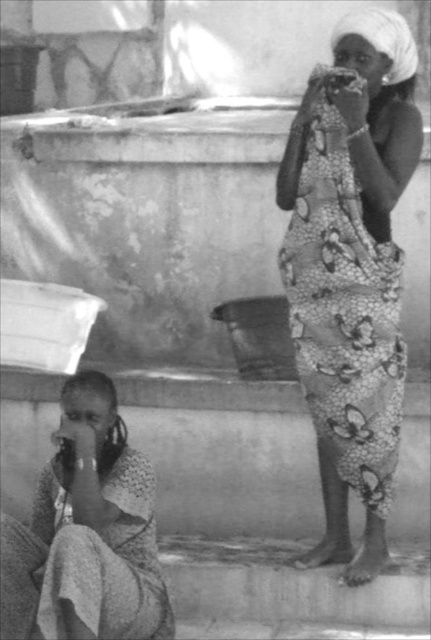
Question: Does floral-patterned fabric at right have a smaller size compared to patterned fabric cloth at lower left?

Choices:
 (A) yes
 (B) no

Answer: (B)

Question: Which point is farther to the camera?

Choices:
 (A) (409, 128)
 (B) (149, 611)

Answer: (A)

Question: Is floral-patterned fabric at right below patterned fabric cloth at lower left?

Choices:
 (A) no
 (B) yes

Answer: (A)

Question: Does floral-patterned fabric at right have a smaller size compared to patterned fabric cloth at lower left?

Choices:
 (A) no
 (B) yes

Answer: (A)

Question: Which point is farther from the camera taking this photo?

Choices:
 (A) (315, 256)
 (B) (153, 477)

Answer: (A)